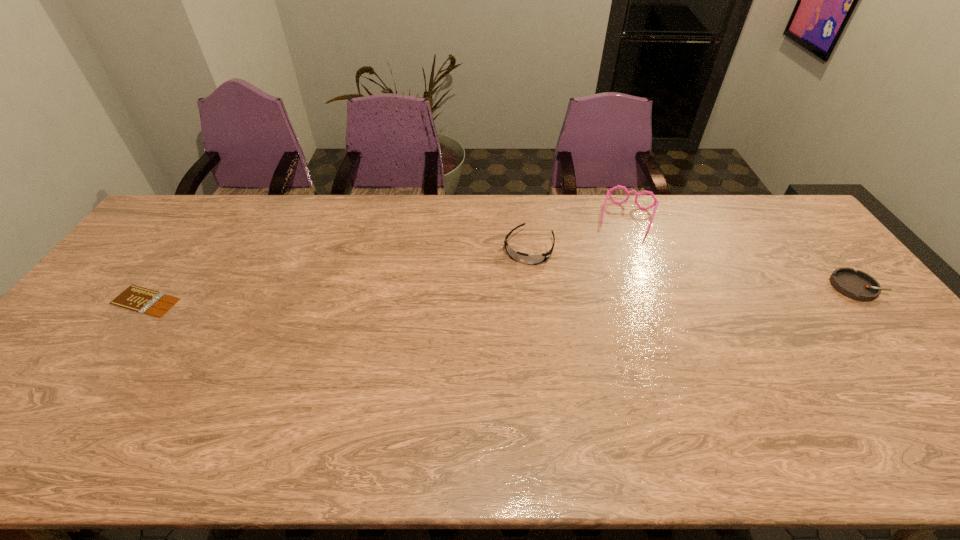
Locate an element on the screen. free spot on the desktop that is between the shortest object and the ashtray and is positioned on the lenses of the third shortest object is located at coordinates (507, 294).

The height and width of the screenshot is (540, 960). In order to click on vacant space on the desktop that is between the shortest object and the second shortest object and is positioned on the arms of the second object from right to left in this screenshot , I will do `click(608, 292)`.